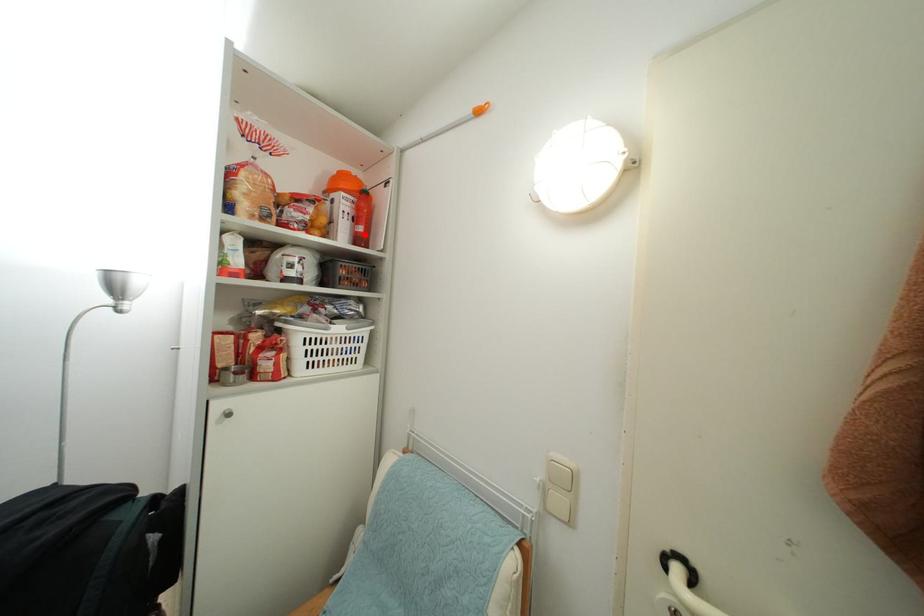
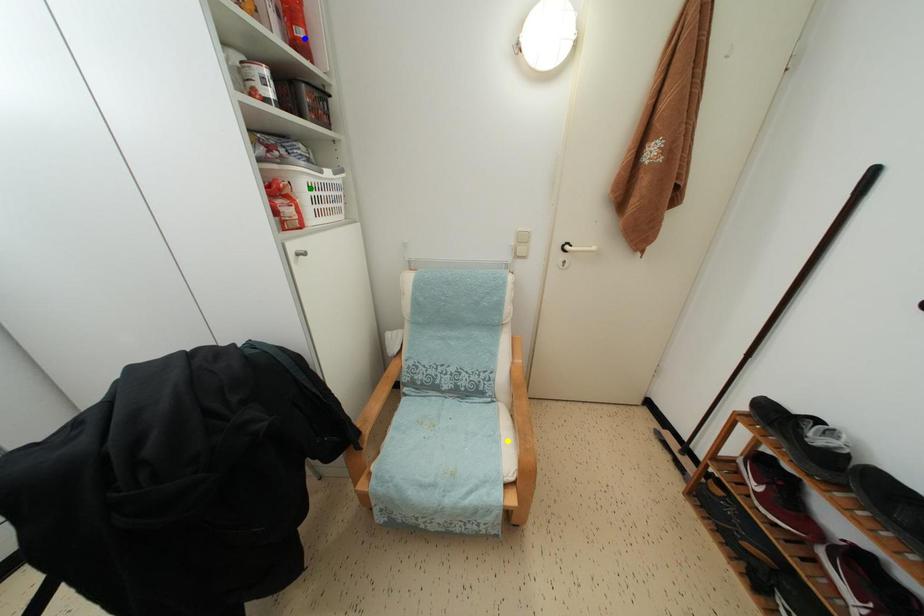
Question: I am providing you with two images of the same scene from different viewpoints. A red point is marked on the first image. You are given multiple points on the second image. Which point in image 2 represents the same 3d spot as the red point in image 1?

Choices:
 (A) blue point
 (B) green point
 (C) yellow point

Answer: (A)